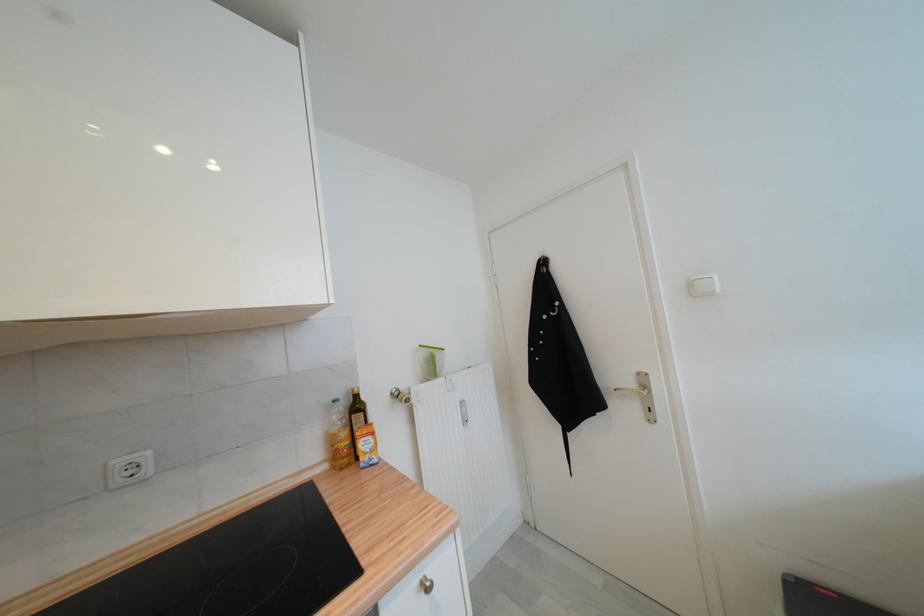
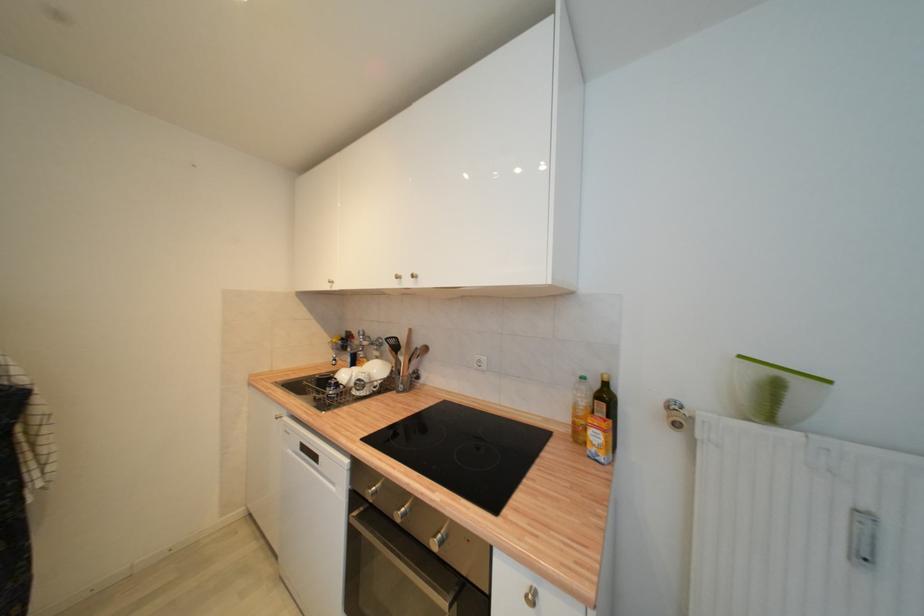
In the second image, find the point that corresponds to point 339,403 in the first image.

(586, 379)